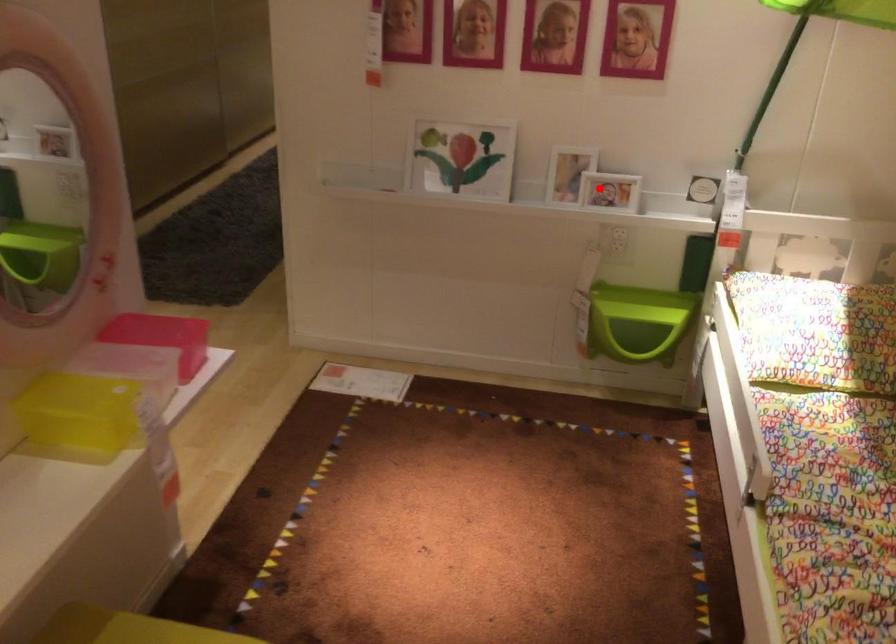
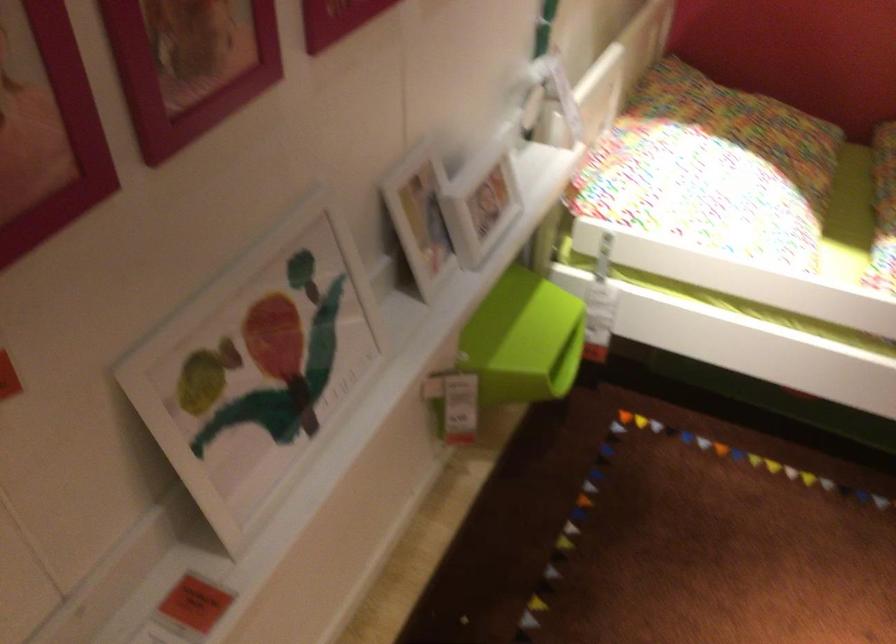
Locate, in the second image, the point that corresponds to the highlighted location in the first image.

(479, 200)